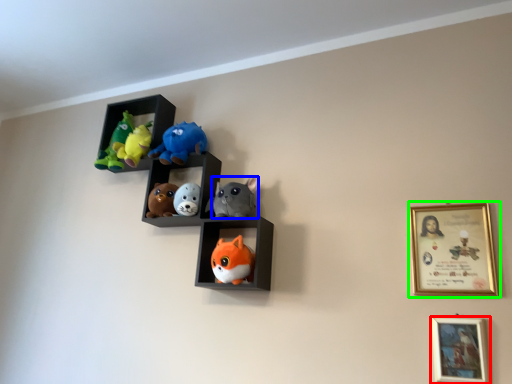
Question: Which is nearer to the picture frame (highlighted by a red box)? toy (highlighted by a blue box) or picture frame (highlighted by a green box).

Choices:
 (A) toy
 (B) picture frame

Answer: (B)